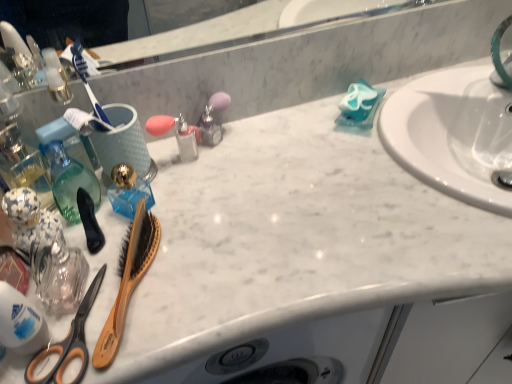
Find the location of a particular element. vacant region to the left of blue matte soap at upper right, which is counted as the second cleaning product, starting from the left is located at coordinates (288, 132).